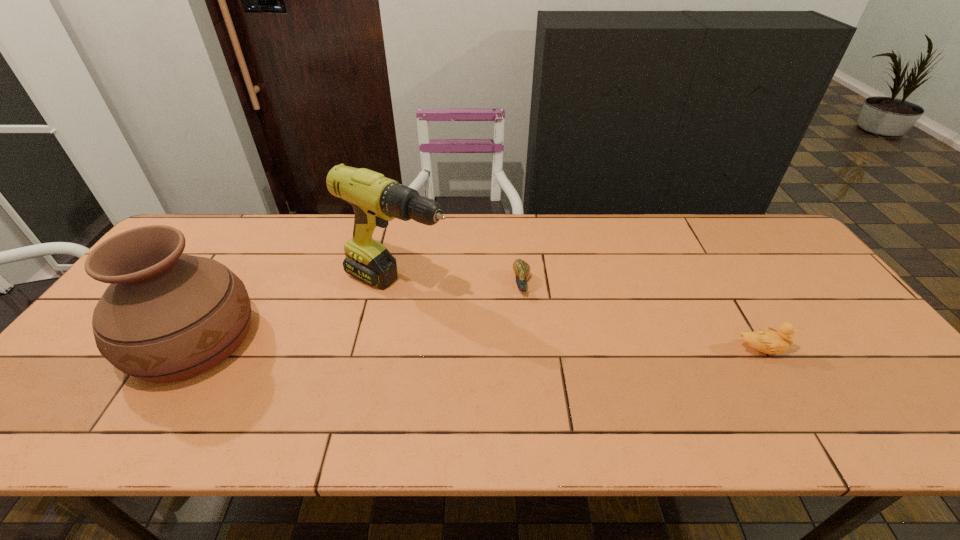
Where is `free spot on the desktop that is between the leftmost object and the duckling and is positioned on the front-facing side of the escargot`? free spot on the desktop that is between the leftmost object and the duckling and is positioned on the front-facing side of the escargot is located at coordinates (528, 346).

Find the location of a particular element. This screenshot has height=540, width=960. free space on the desktop that is between the leftmost object and the rightmost object and is positioned on the handle side of the drill is located at coordinates (524, 346).